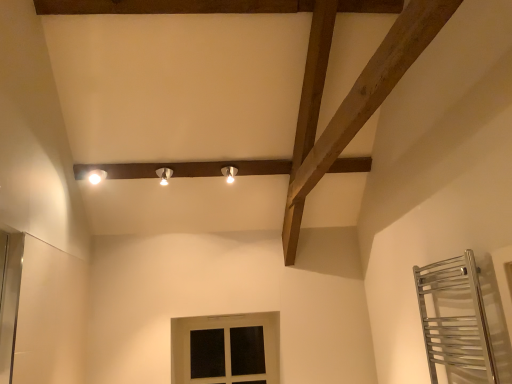
Question: Does matte black window at lower center have a smaller size compared to white glossy light fixture at upper left, the first light fixture when ordered from left to right?

Choices:
 (A) yes
 (B) no

Answer: (B)

Question: Is the position of matte black window at lower center more distant than that of white glossy light fixture at upper left, the first light fixture when ordered from left to right?

Choices:
 (A) no
 (B) yes

Answer: (B)

Question: From the image's perspective, would you say matte black window at lower center is shown under white glossy light fixture at upper left, the 3th light fixture positioned from the right?

Choices:
 (A) no
 (B) yes

Answer: (B)

Question: Is matte black window at lower center directly adjacent to white glossy light fixture at upper left, the first light fixture when ordered from left to right?

Choices:
 (A) no
 (B) yes

Answer: (A)

Question: Is matte black window at lower center aimed at white glossy light fixture at upper left, the 3th light fixture positioned from the right?

Choices:
 (A) yes
 (B) no

Answer: (B)

Question: In the image, is matte silver light fixture at center, the second light fixture positioned from the left, on the left side or the right side of matte black window at lower center?

Choices:
 (A) left
 (B) right

Answer: (A)

Question: Is matte silver light fixture at center, the second light fixture positioned from the left, in front of or behind matte black window at lower center in the image?

Choices:
 (A) behind
 (B) front

Answer: (B)

Question: Looking at their shapes, would you say matte silver light fixture at center, the second light fixture positioned from the left, is wider or thinner than matte black window at lower center?

Choices:
 (A) thin
 (B) wide

Answer: (B)

Question: From the image's perspective, is matte silver light fixture at center, which is counted as the second light fixture, starting from the right, positioned above or below matte black window at lower center?

Choices:
 (A) below
 (B) above

Answer: (B)

Question: From their relative heights in the image, would you say white glossy light fixture at upper center, the third light fixture viewed from the left, is taller or shorter than white glossy light fixture at upper left, the 3th light fixture positioned from the right?

Choices:
 (A) short
 (B) tall

Answer: (A)

Question: Would you say white glossy light fixture at upper center, the third light fixture viewed from the left, is to the left or to the right of white glossy light fixture at upper left, the first light fixture when ordered from left to right, in the picture?

Choices:
 (A) left
 (B) right

Answer: (B)

Question: Considering the positions of white glossy light fixture at upper center, placed as the 1th light fixture when sorted from right to left, and white glossy light fixture at upper left, the 3th light fixture positioned from the right, in the image, is white glossy light fixture at upper center, placed as the 1th light fixture when sorted from right to left, wider or thinner than white glossy light fixture at upper left, the 3th light fixture positioned from the right,?

Choices:
 (A) wide
 (B) thin

Answer: (B)

Question: In terms of size, does white glossy light fixture at upper center, placed as the 1th light fixture when sorted from right to left, appear bigger or smaller than white glossy light fixture at upper left, the first light fixture when ordered from left to right?

Choices:
 (A) small
 (B) big

Answer: (A)

Question: From a real-world perspective, is matte black window at lower center positioned above or below matte silver light fixture at center, which is counted as the second light fixture, starting from the right?

Choices:
 (A) below
 (B) above

Answer: (A)

Question: From the image's perspective, is matte black window at lower center positioned above or below matte silver light fixture at center, which is counted as the second light fixture, starting from the right?

Choices:
 (A) below
 (B) above

Answer: (A)